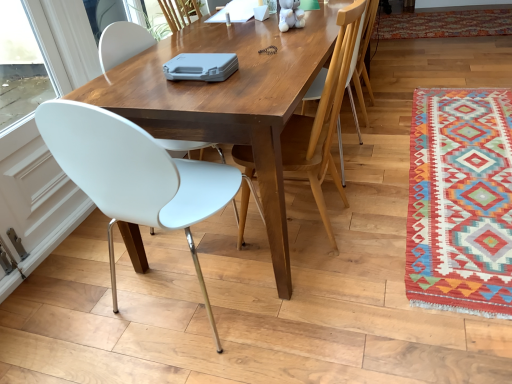
Where is `free space between wooden table at center and multicolored woven rug at lower right, which is counted as the 1th mat, starting from the front`? The height and width of the screenshot is (384, 512). free space between wooden table at center and multicolored woven rug at lower right, which is counted as the 1th mat, starting from the front is located at coordinates (390, 191).